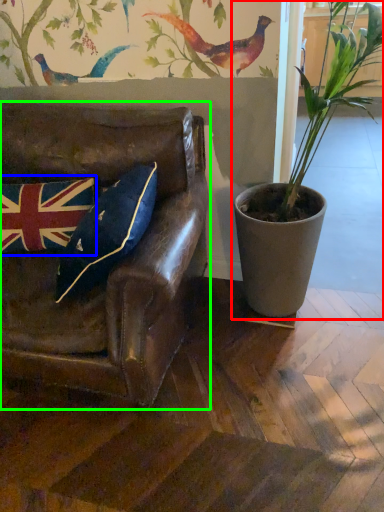
Question: Based on their relative distances, which object is farther from houseplant (highlighted by a red box)? Choose from flag (highlighted by a blue box) and chair (highlighted by a green box).

Choices:
 (A) flag
 (B) chair

Answer: (A)